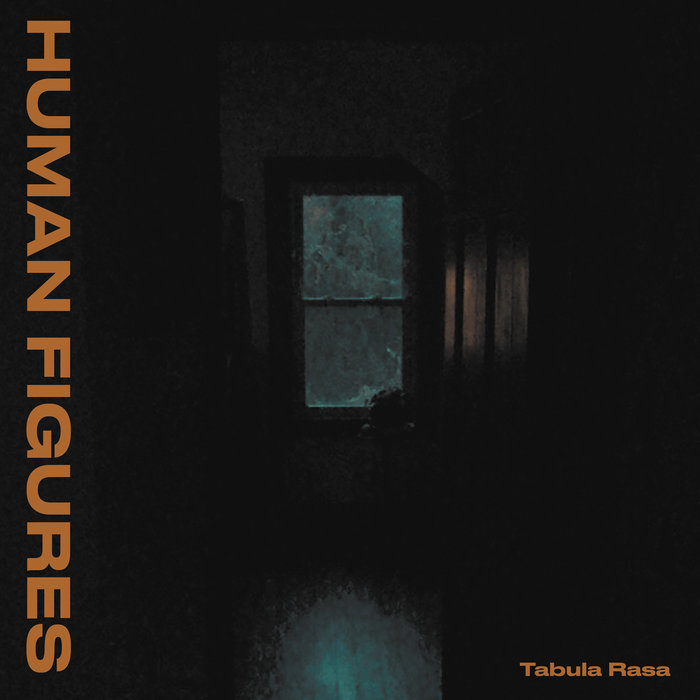
This screenshot has width=700, height=700. In order to click on picture in this screenshot , I will do `click(232, 245)`.